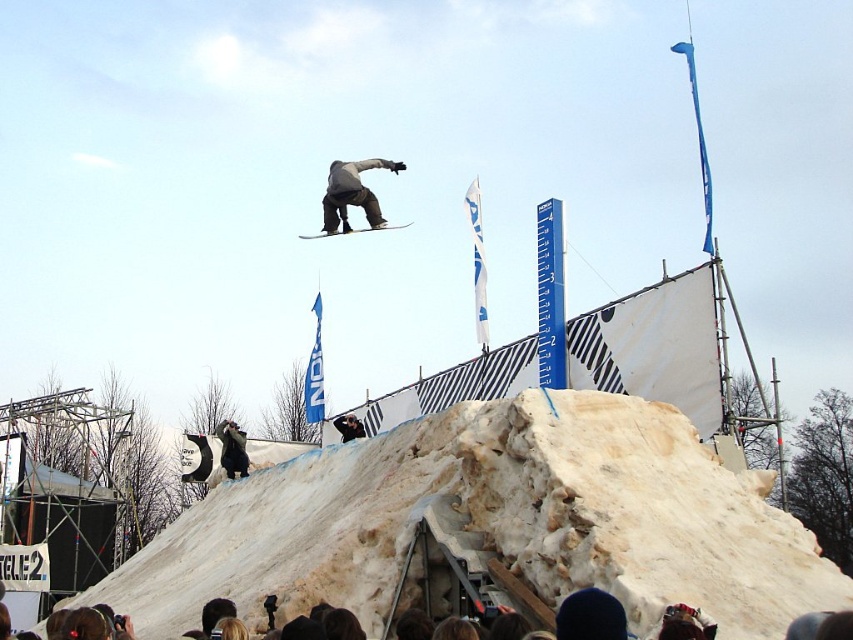
You are a photographer at the snowboarding event. You need to capture the snowboarder at the exact point marked by coordinates point (352, 195). Where should you position your camera to ensure the snowboarder is centered in your shot?

The point (352, 195) marks the gray matte snowboarder at center, so you should position your camera directly facing the center where the snowboarder is located to ensure they are centered in your shot.

You are a photographer at the snowboarding event, and you want to capture a photo of the matte black snowboard at center against the white fluffy mound at lower center. Based on the scene, will the snowboard be clearly visible against the background?

A: The white fluffy mound at lower center is positioned under the matte black snowboard at center, so the contrast between the two will make the matte black snowboard at center stand out clearly against the white fluffy mound at lower center.

You are a photographer standing at the camera position. You want to capture a photo of the point at coordinate (692, 582). If your camera has a focal length of 50mm and the sensor size is 36mm wide, what is the horizontal distance in meters between the camera and the point?

The horizontal distance between the camera and the point at coordinate (692, 582) can be calculated using the formula distance equals focal length multiplied by sensor width divided by object width. However, since the given distance is 57.94 meters, this is the direct measurement between the point and the camera. Therefore, the horizontal distance is 57.94 meters.